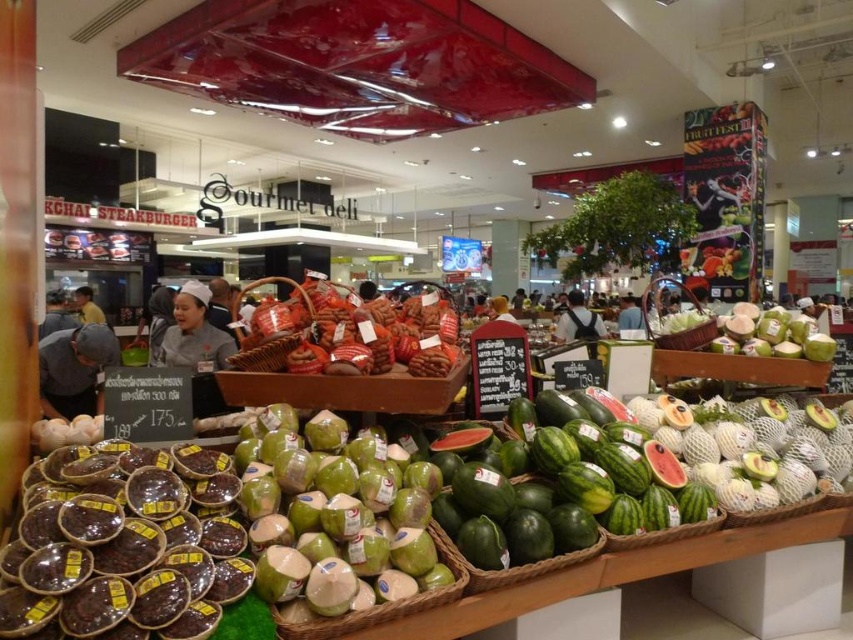
Question: Can you confirm if watermelon at center is thinner than white uniform at center?

Choices:
 (A) yes
 (B) no

Answer: (B)

Question: Does matte gray cap at lower left have a lesser width compared to white uniform at center?

Choices:
 (A) no
 (B) yes

Answer: (B)

Question: Which of these objects is positioned closest to the watermelon at center?

Choices:
 (A) matte gray cap at lower left
 (B) light blue shirt at center
 (C) yellow shirt at left
 (D) green matte coconut at lower left

Answer: (D)

Question: Considering the real-world distances, which object is closest to the black backpack at center?

Choices:
 (A) watermelon at center
 (B) matte gray cap at lower left
 (C) green matte coconut at lower left

Answer: (A)

Question: Which object is closer to the camera taking this photo?

Choices:
 (A) brown textured bread at center
 (B) black backpack at center

Answer: (A)

Question: Is white uniform at center below light blue shirt at center?

Choices:
 (A) no
 (B) yes

Answer: (B)